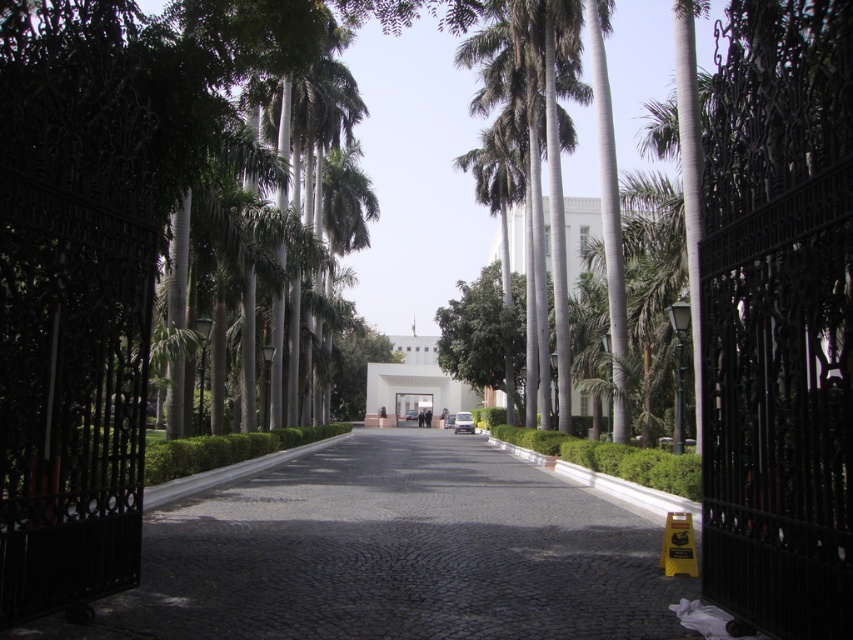
Consider the image. You are standing at the entrance of the pathway and want to walk towards the large white building. According to the image, where exactly is the cobblestone pavement at center located in terms of coordinates?

The cobblestone pavement at center is located at point [393,554].

In the scene shown: You are standing at the entrance of a garden and see the cobblestone pavement at center and the green leafy palm tree at center. Which object is positioned to the left of the other?

The cobblestone pavement at center is to the left of green leafy palm tree at center.